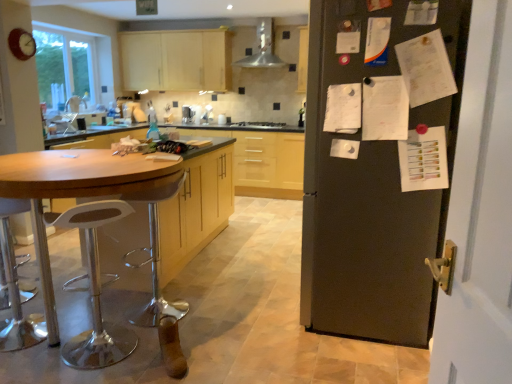
At what (x,y) coordinates should I click in order to perform the action: click on empty space that is in between wooden table at left and matte black refrigerator at right. Please return your answer as a coordinate pair (x, y). Image resolution: width=512 pixels, height=384 pixels. Looking at the image, I should click on (250, 322).